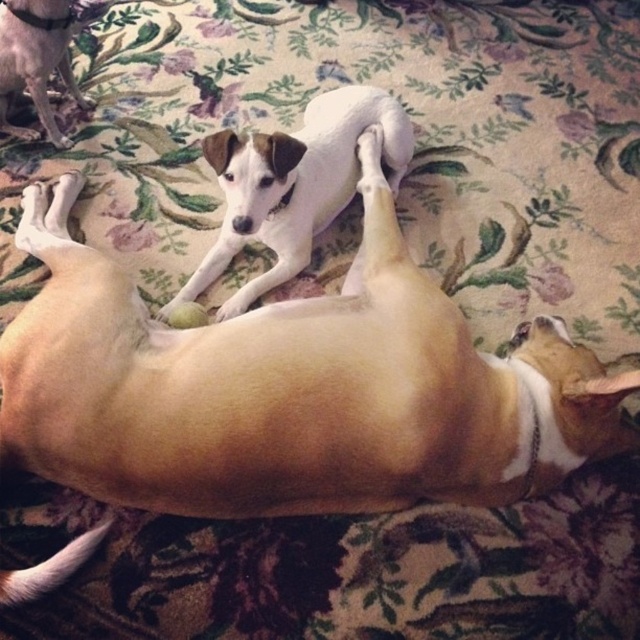
You are a photographer trying to capture a portrait of both the light brown fur at center and the white smooth dog at center. Since you want both subjects to be clearly visible in the frame, which dog should you position closer to the camera to ensure their faces are in focus?

The light brown fur at center is taller than the white smooth dog at center, so positioning the shorter white smooth dog at center closer to the camera will help ensure both faces are in focus.

You are a photographer standing 6 feet away from the camera. You want to take a photo of the light brown fur at center. Can you step forward to get a closer shot without moving the dog?

The light brown fur at center is 4.05 feet away from the camera. Since you are standing 6 feet away from the camera, stepping forward would bring you closer to the dog, but you need to ensure you don not step into the frame. However, the question is about your position relative to the camera, not the dog. To get a closer shot, you can move forward towards the camera until you are between 4.05 feet and your current 6 feet distance. However, if you need to be closer than 4.05 feet to the camera to capture the